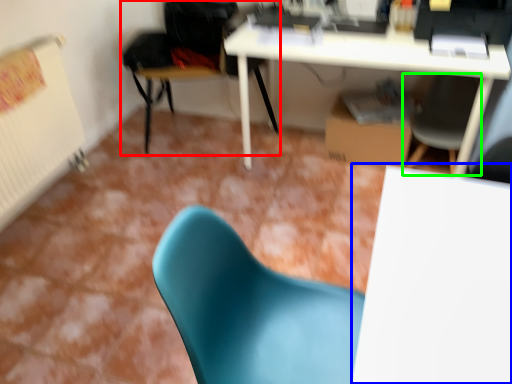
Question: Based on their relative distances, which object is nearer to chair (highlighted by a red box)? Choose from table (highlighted by a blue box) and chair (highlighted by a green box).

Choices:
 (A) table
 (B) chair

Answer: (B)